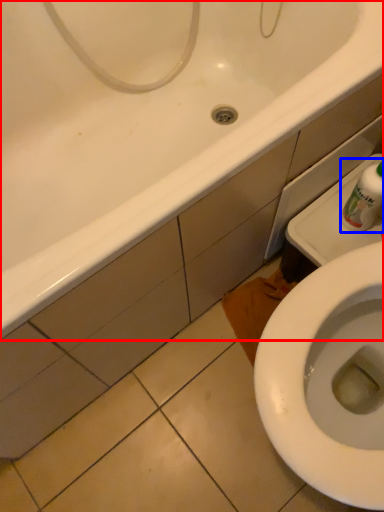
Question: Which object appears closest to the camera in this image, bathtub (highlighted by a red box) or cleaning product (highlighted by a blue box)?

Choices:
 (A) bathtub
 (B) cleaning product

Answer: (A)